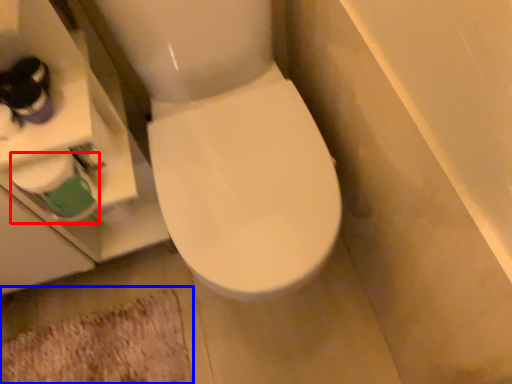
Question: Among these objects, which one is nearest to the camera, toilet paper (highlighted by a red box) or bath mat (highlighted by a blue box)?

Choices:
 (A) toilet paper
 (B) bath mat

Answer: (A)